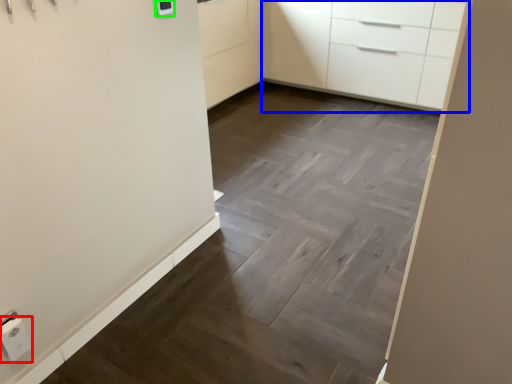
Question: Based on their relative distances, which object is farther from electric outlet (highlighted by a red box)? Choose from chest of drawers (highlighted by a blue box) and light switch (highlighted by a green box).

Choices:
 (A) chest of drawers
 (B) light switch

Answer: (A)